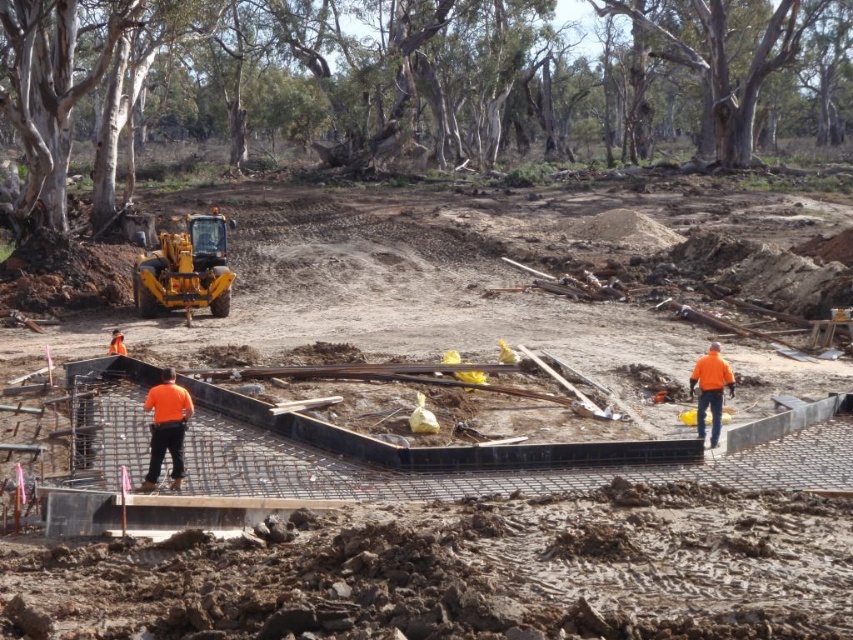
You are a safety inspector standing at the edge of the construction site. You see the black concrete foundation at center and the orange fabric construction worker at center. Which object is closer to you?

The black concrete foundation at center is closer to the viewer than the orange fabric construction worker at center.

You are a safety inspector at the construction site. You notice two workers wearing orange fabric construction worker at center and orange fabric construction worker at right. Which worker is positioned closer to the excavator parked near the edge?

The orange fabric construction worker at right is closer to the excavator parked near the edge because the orange fabric construction worker at center is to the left of orange fabric construction worker at right, implying the worker at right is positioned further towards the excavator location.

You are standing at the center of the construction site and want to locate the orange fabric construction worker at center. Which direction should you look to find them?

The orange fabric construction worker at center is located at point [166,428], so you should look to the right side of the scene.